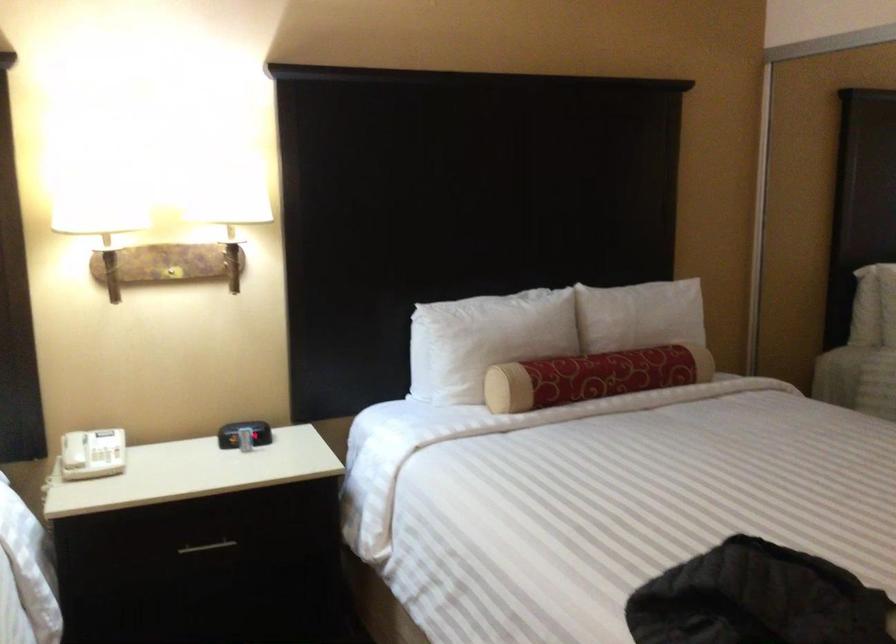
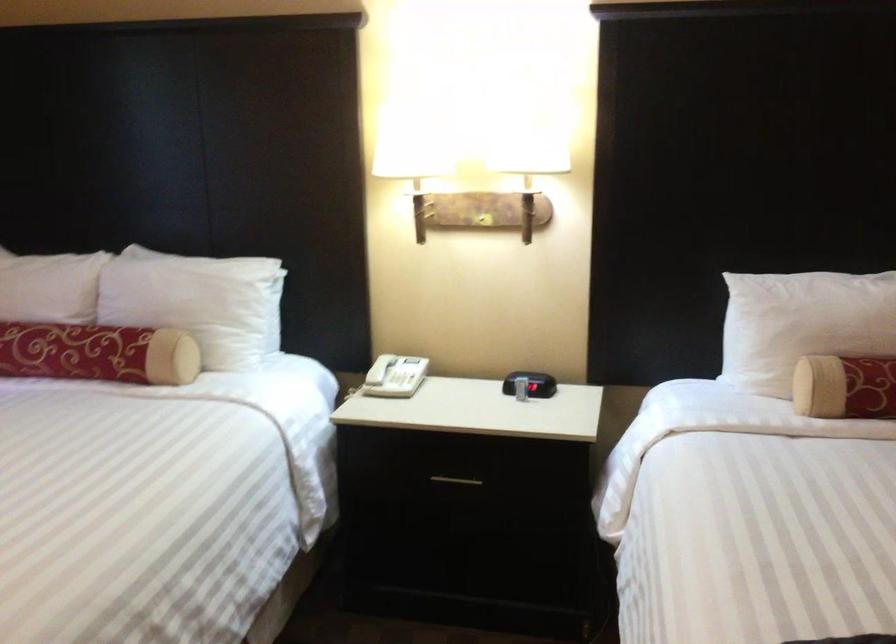
The point at (486, 344) is marked in the first image. Where is the corresponding point in the second image?

(802, 324)